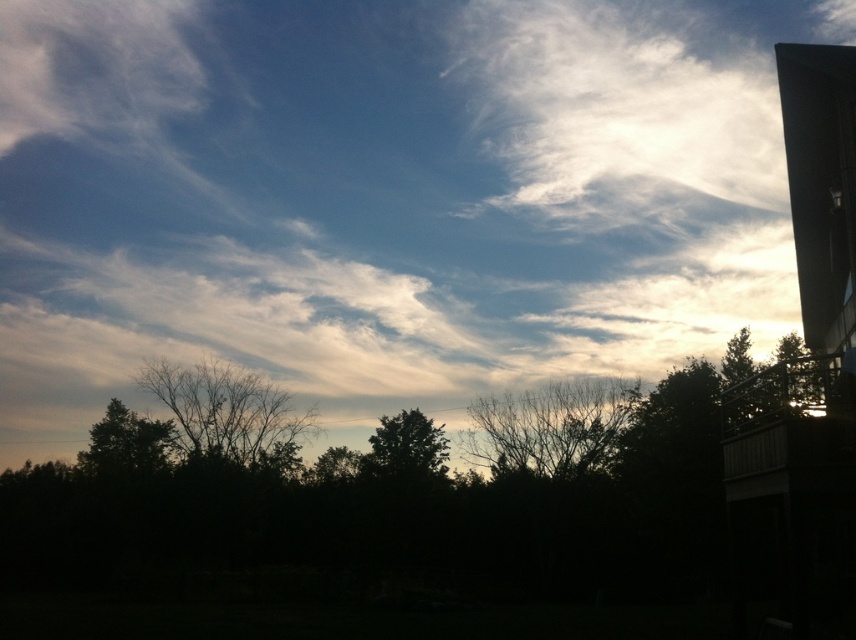
Does bare branches at center appear over dark green leafy tree at lower left?

Correct, bare branches at center is located above dark green leafy tree at lower left.

Between point (510, 436) and point (111, 448), which one is positioned in front?

Point (510, 436) is more forward.

At what (x,y) coordinates should I click in order to perform the action: click on bare branches at center. Please return your answer as a coordinate pair (x, y). This screenshot has width=856, height=640. Looking at the image, I should click on (550, 426).

Does bare branches at center appear under brown leafless tree at lower left?

Yes.

Does bare branches at center have a greater height compared to brown leafless tree at lower left?

No.

At what (x,y) coordinates should I click in order to perform the action: click on bare branches at center. Please return your answer as a coordinate pair (x, y). Looking at the image, I should click on coord(550,426).

Who is positioned more to the left, white fluffy cloud at upper center or green leafy tree at center?

Positioned to the left is green leafy tree at center.

Does white fluffy cloud at upper center have a lesser width compared to green leafy tree at center?

In fact, white fluffy cloud at upper center might be wider than green leafy tree at center.

What do you see at coordinates (384, 196) in the screenshot? I see `white fluffy cloud at upper center` at bounding box center [384, 196].

Where is `white fluffy cloud at upper center`? This screenshot has height=640, width=856. white fluffy cloud at upper center is located at coordinates (384, 196).